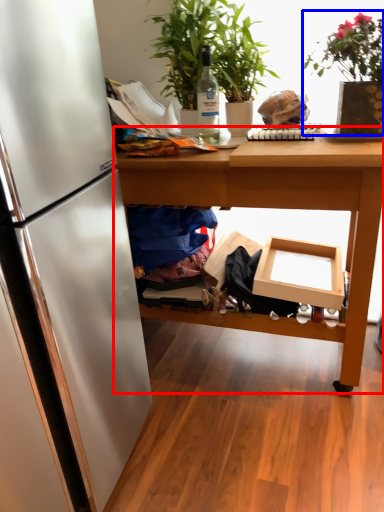
Question: Which of the following is the farthest to the observer, table (highlighted by a red box) or houseplant (highlighted by a blue box)?

Choices:
 (A) table
 (B) houseplant

Answer: (A)